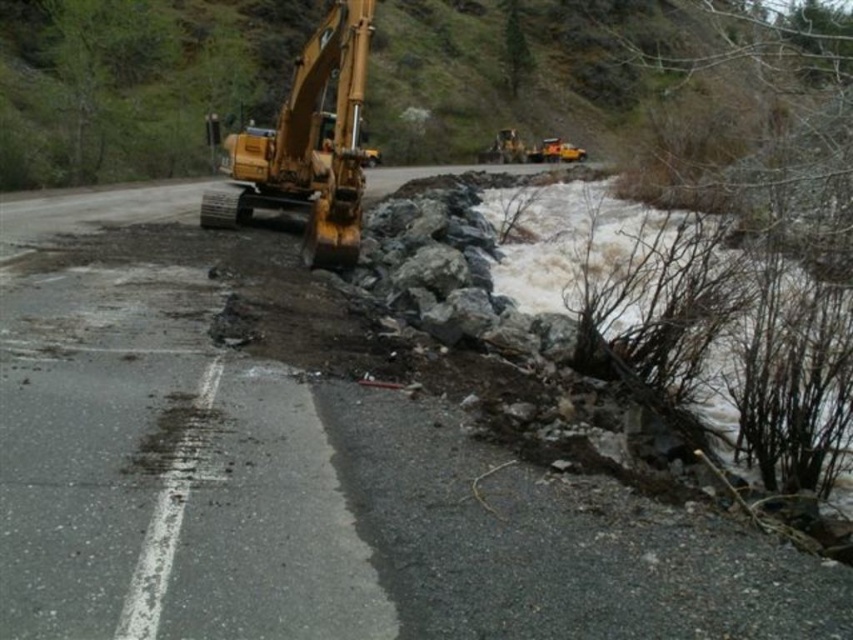
Does white frothy water at lower right appear on the right side of yellow metallic excavator at left?

Indeed, white frothy water at lower right is positioned on the right side of yellow metallic excavator at left.

Is white frothy water at lower right below yellow metallic excavator at left?

Yes.

Who is more distant from viewer, (740, 332) or (329, 246)?

Point (329, 246)

You are a GUI agent. You are given a task and a screenshot of the screen. Output one action in this format:
    pyautogui.click(x=<x>, y=<y>)
    Task: Click on the white frothy water at lower right
    The image size is (853, 640).
    Given the screenshot: What is the action you would take?
    pyautogui.click(x=697, y=324)

Is point (590, 355) closer to camera compared to point (566, 160)?

Yes, point (590, 355) is closer to viewer.

This screenshot has height=640, width=853. I want to click on white frothy water at lower right, so click(697, 324).

The width and height of the screenshot is (853, 640). I want to click on white frothy water at lower right, so click(697, 324).

Identify the location of white frothy water at lower right. (697, 324).

From the picture: Which is more to the left, yellow metallic excavator at left or yellow metallic excavator at center?

From the viewer's perspective, yellow metallic excavator at left appears more on the left side.

Which is in front, point (233, 134) or point (491, 154)?

Positioned in front is point (233, 134).

The width and height of the screenshot is (853, 640). I want to click on yellow metallic excavator at left, so click(x=308, y=147).